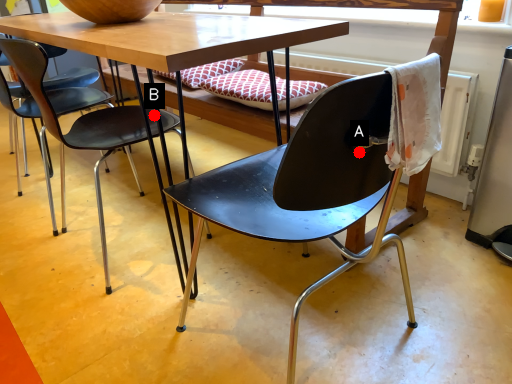
Question: Two points are circled on the image, labeled by A and B beside each circle. Which point is farther to the camera?

Choices:
 (A) A is further
 (B) B is further

Answer: (B)